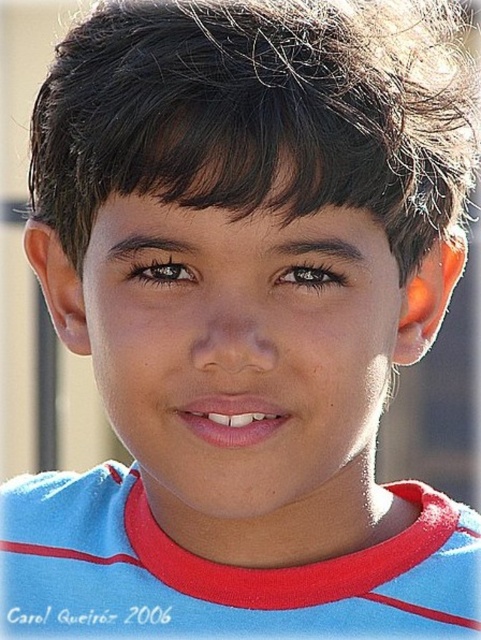
Question: Which point is closer to the camera?

Choices:
 (A) (141, 218)
 (B) (152, 564)
 (C) (65, 97)

Answer: (A)

Question: Is dark brown shiny hair at center positioned in front of blue fabric shirt at center?

Choices:
 (A) no
 (B) yes

Answer: (B)

Question: Which point appears closest to the camera in this image?

Choices:
 (A) (211, 284)
 (B) (63, 548)
 (C) (345, 118)

Answer: (C)

Question: Is dark brown shiny hair at center smaller than blue fabric shirt at center?

Choices:
 (A) no
 (B) yes

Answer: (A)

Question: Which point appears farthest from the camera in this image?

Choices:
 (A) (103, 301)
 (B) (90, 109)

Answer: (A)

Question: Is dark brown shiny hair at center closer to camera compared to smooth skin face at center?

Choices:
 (A) yes
 (B) no

Answer: (A)